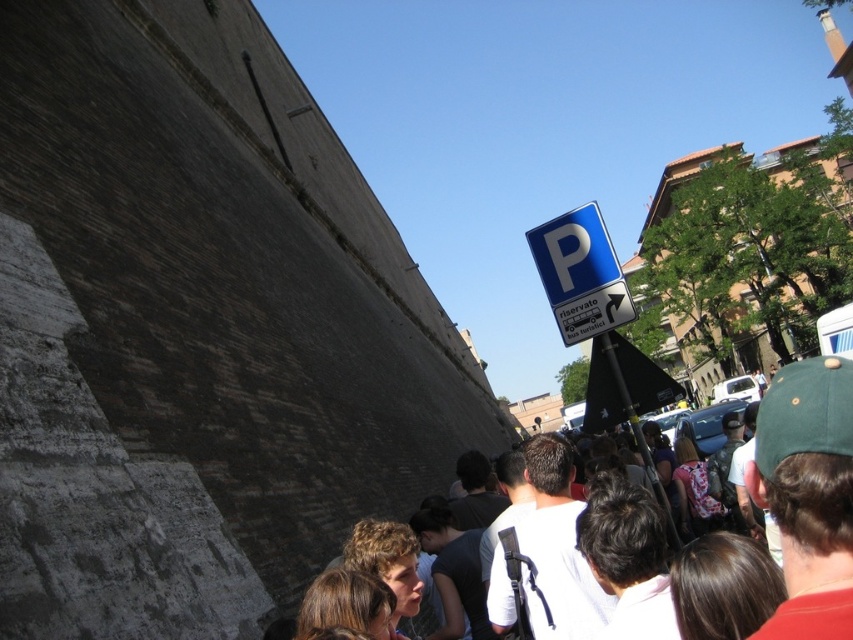
Between brown hair at center and blue plastic parking sign at upper right, which one has more height?

brown hair at center

Who is positioned more to the right, brown hair at center or blue plastic parking sign at upper right?

From the viewer's perspective, brown hair at center appears more on the right side.

Is point (801, 600) positioned in front of point (601, 220)?

Yes, it is.

I want to click on brown hair at center, so click(x=808, y=493).